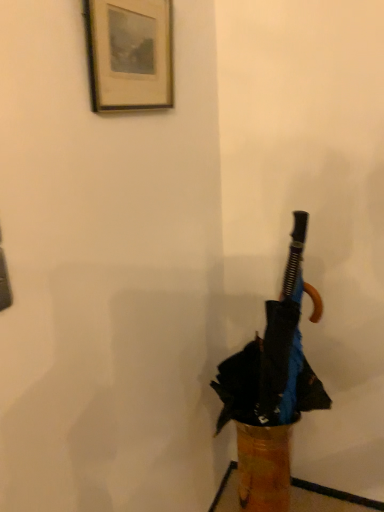
Question: Is wooden framed print at upper left taller or shorter than black matte umbrella at center?

Choices:
 (A) tall
 (B) short

Answer: (B)

Question: From the image's perspective, is wooden framed print at upper left positioned above or below black matte umbrella at center?

Choices:
 (A) below
 (B) above

Answer: (B)

Question: Looking at the image, does wooden framed print at upper left seem bigger or smaller compared to black matte umbrella at center?

Choices:
 (A) small
 (B) big

Answer: (A)

Question: Looking at their shapes, would you say black matte umbrella at center is wider or thinner than wooden framed print at upper left?

Choices:
 (A) thin
 (B) wide

Answer: (B)

Question: From the image's perspective, is black matte umbrella at center above or below wooden framed print at upper left?

Choices:
 (A) above
 (B) below

Answer: (B)

Question: In terms of size, does black matte umbrella at center appear bigger or smaller than wooden framed print at upper left?

Choices:
 (A) big
 (B) small

Answer: (A)

Question: In terms of height, does black matte umbrella at center look taller or shorter compared to wooden framed print at upper left?

Choices:
 (A) tall
 (B) short

Answer: (A)